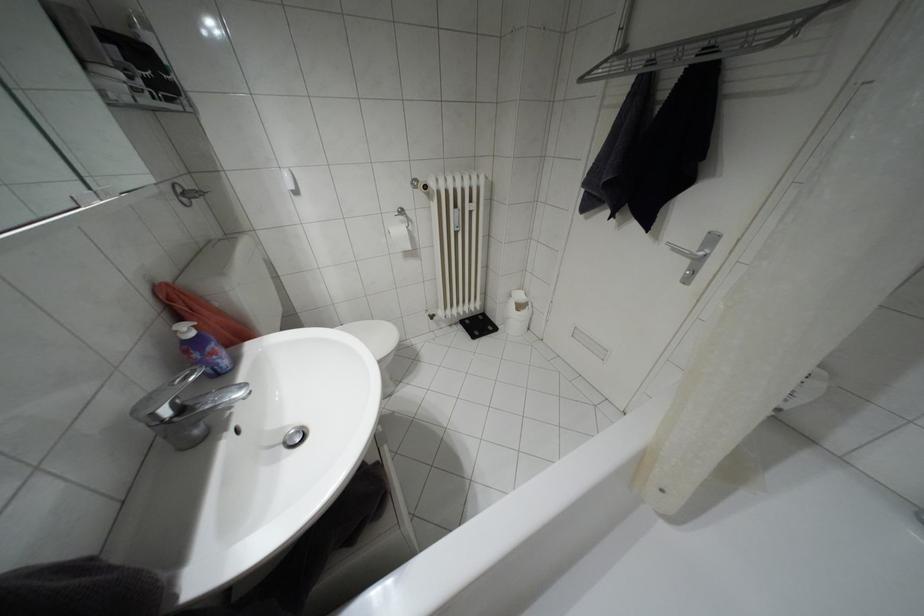
Where would you push the silver door handle? Please return your answer as a coordinate pair (x, y).

(698, 246)